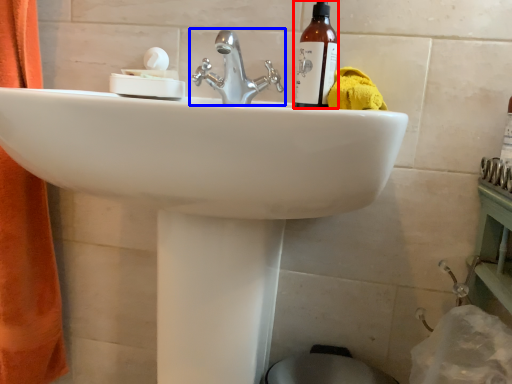
Question: Which object appears closest to the camera in this image, bottle (highlighted by a red box) or tap (highlighted by a blue box)?

Choices:
 (A) bottle
 (B) tap

Answer: (B)